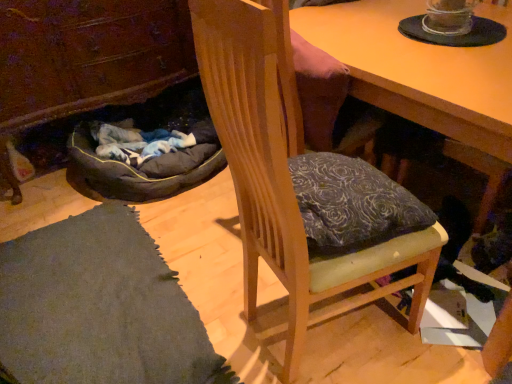
Question: Is wooden chair at center positioned behind wooden desk at center?

Choices:
 (A) no
 (B) yes

Answer: (A)

Question: Is wooden chair at center surrounding wooden desk at center?

Choices:
 (A) yes
 (B) no

Answer: (B)

Question: Is wooden chair at center shorter than wooden desk at center?

Choices:
 (A) no
 (B) yes

Answer: (A)

Question: From a real-world perspective, does wooden chair at center sit lower than wooden desk at center?

Choices:
 (A) yes
 (B) no

Answer: (B)

Question: From the image's perspective, is wooden chair at center beneath wooden desk at center?

Choices:
 (A) no
 (B) yes

Answer: (B)

Question: Is wooden chair at center directly adjacent to wooden desk at center?

Choices:
 (A) no
 (B) yes

Answer: (A)

Question: From the image's perspective, is wooden cabinet at lower left beneath wooden chair at center?

Choices:
 (A) yes
 (B) no

Answer: (B)

Question: Can you confirm if wooden cabinet at lower left is wider than wooden chair at center?

Choices:
 (A) yes
 (B) no

Answer: (A)

Question: From a real-world perspective, is wooden cabinet at lower left on top of wooden chair at center?

Choices:
 (A) no
 (B) yes

Answer: (A)

Question: Does wooden cabinet at lower left have a greater height compared to wooden chair at center?

Choices:
 (A) yes
 (B) no

Answer: (B)

Question: Is wooden cabinet at lower left turned away from wooden chair at center?

Choices:
 (A) yes
 (B) no

Answer: (B)

Question: From the image's perspective, is wooden cabinet at lower left on top of wooden chair at center?

Choices:
 (A) yes
 (B) no

Answer: (A)

Question: Considering the relative sizes of wooden cabinet at lower left and wooden desk at center in the image provided, is wooden cabinet at lower left bigger than wooden desk at center?

Choices:
 (A) no
 (B) yes

Answer: (A)